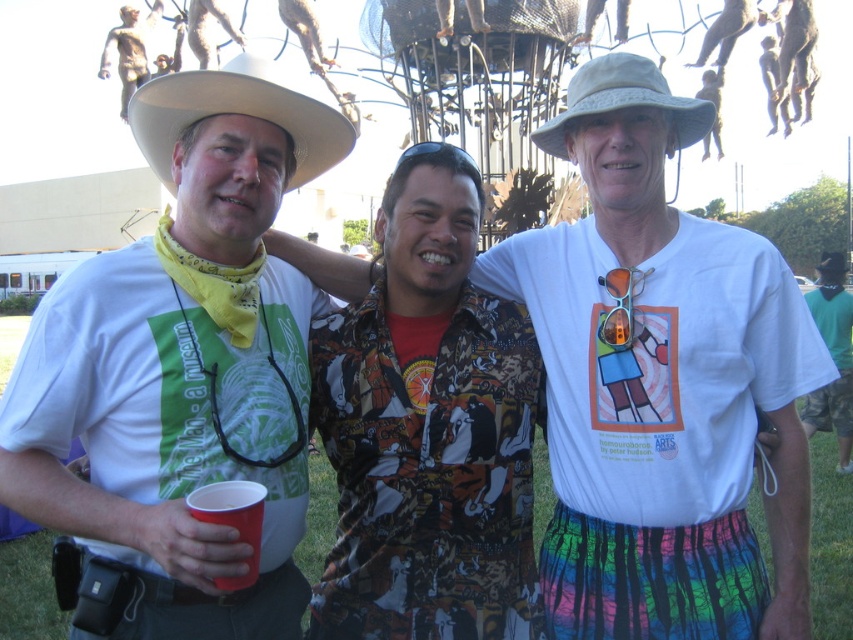
Does white cotton shirt at center appear over matte gold statue at upper left?

Actually, white cotton shirt at center is below matte gold statue at upper left.

Is point (624, 378) positioned after point (132, 65)?

No, (624, 378) is closer to viewer.

Locate an element on the screen. The image size is (853, 640). white cotton shirt at center is located at coordinates (660, 384).

Is point (202, 508) less distant than point (106, 35)?

Yes, point (202, 508) is in front of point (106, 35).

Which is behind, point (218, 577) or point (138, 48)?

Positioned behind is point (138, 48).

What do you see at coordinates (231, 520) in the screenshot? I see `red plastic cup at lower left` at bounding box center [231, 520].

Find the location of a particular element. This screenshot has height=640, width=853. red plastic cup at lower left is located at coordinates (231, 520).

Is white matte cowboy hat at upper left further to camera compared to red plastic cup at lower left?

No, it is not.

Can you confirm if white matte cowboy hat at upper left is positioned below red plastic cup at lower left?

No.

Measure the distance between white matte cowboy hat at upper left and camera.

white matte cowboy hat at upper left and camera are 52.21 meters apart.

Image resolution: width=853 pixels, height=640 pixels. What are the coordinates of `white matte cowboy hat at upper left` in the screenshot? It's located at (181, 371).